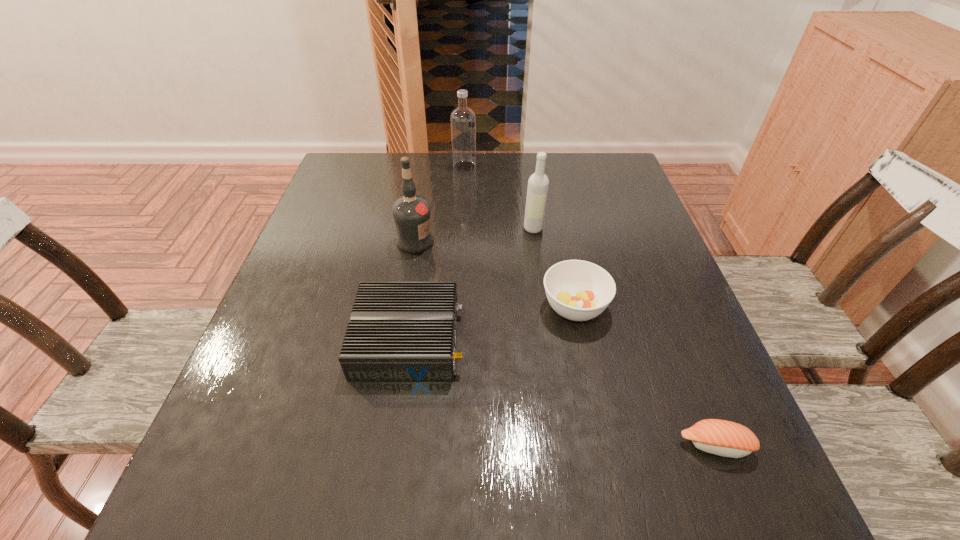
Identify the location of the leftmost vodka. (412, 215).

This screenshot has width=960, height=540. I want to click on the second vodka from left to right, so click(x=463, y=120).

The width and height of the screenshot is (960, 540). I want to click on the farthest vodka, so click(463, 120).

Find the location of `the rightmost vodka`. the rightmost vodka is located at coordinates click(x=538, y=183).

Identify the location of router. (398, 331).

In order to click on soup bowl in this screenshot , I will do `click(577, 290)`.

Where is `sushi`? sushi is located at coordinates (724, 438).

The height and width of the screenshot is (540, 960). What are the coordinates of `the shortest object` in the screenshot? It's located at (724, 438).

This screenshot has height=540, width=960. Find the location of `vacant space located 0.080m on the front label of the leftmost vodka`. vacant space located 0.080m on the front label of the leftmost vodka is located at coordinates (468, 242).

Image resolution: width=960 pixels, height=540 pixels. Find the location of `vacant region located on the front label of the farthest object`. vacant region located on the front label of the farthest object is located at coordinates (550, 166).